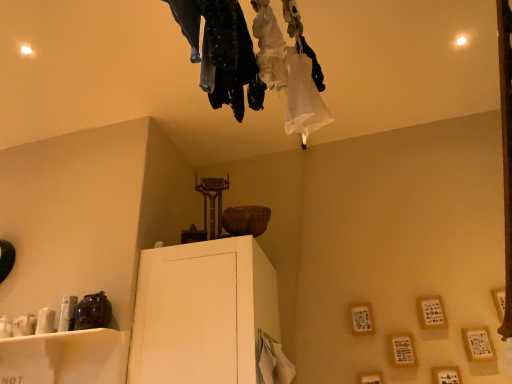
Question: Is dark textured pants at upper center bigger than white glossy shelf at lower left, which is the 2th furniture in right-to-left order?

Choices:
 (A) no
 (B) yes

Answer: (A)

Question: Is dark textured pants at upper center facing away from white glossy shelf at lower left, the 1th furniture in the left-to-right sequence?

Choices:
 (A) yes
 (B) no

Answer: (B)

Question: Is dark textured pants at upper center aimed at white glossy shelf at lower left, the 1th furniture in the left-to-right sequence?

Choices:
 (A) no
 (B) yes

Answer: (A)

Question: Does dark textured pants at upper center contain white glossy shelf at lower left, the 1th furniture in the left-to-right sequence?

Choices:
 (A) no
 (B) yes

Answer: (A)

Question: Is dark textured pants at upper center in front of white glossy shelf at lower left, the 1th furniture in the left-to-right sequence?

Choices:
 (A) no
 (B) yes

Answer: (B)

Question: From a real-world perspective, does dark textured pants at upper center sit lower than white glossy shelf at lower left, which is the 2th furniture in right-to-left order?

Choices:
 (A) no
 (B) yes

Answer: (A)

Question: From the image's perspective, is white matte cabinet at center, which appears as the second furniture when viewed from the left, below white glossy shelf at lower left, which is the 2th furniture in right-to-left order?

Choices:
 (A) no
 (B) yes

Answer: (A)

Question: Can you confirm if white matte cabinet at center, the first furniture viewed from the right, is bigger than white glossy shelf at lower left, which is the 2th furniture in right-to-left order?

Choices:
 (A) yes
 (B) no

Answer: (A)

Question: Does white matte cabinet at center, which appears as the second furniture when viewed from the left, contain white glossy shelf at lower left, which is the 2th furniture in right-to-left order?

Choices:
 (A) no
 (B) yes

Answer: (A)

Question: Is white matte cabinet at center, the first furniture viewed from the right, thinner than white glossy shelf at lower left, which is the 2th furniture in right-to-left order?

Choices:
 (A) yes
 (B) no

Answer: (B)

Question: Is white matte cabinet at center, which appears as the second furniture when viewed from the left, in front of white glossy shelf at lower left, which is the 2th furniture in right-to-left order?

Choices:
 (A) yes
 (B) no

Answer: (B)

Question: Can you confirm if white matte cabinet at center, which appears as the second furniture when viewed from the left, is wider than white glossy shelf at lower left, which is the 2th furniture in right-to-left order?

Choices:
 (A) yes
 (B) no

Answer: (A)

Question: From a real-world perspective, is dark textured pants at upper center physically below white matte cabinet at center, the first furniture viewed from the right?

Choices:
 (A) no
 (B) yes

Answer: (A)